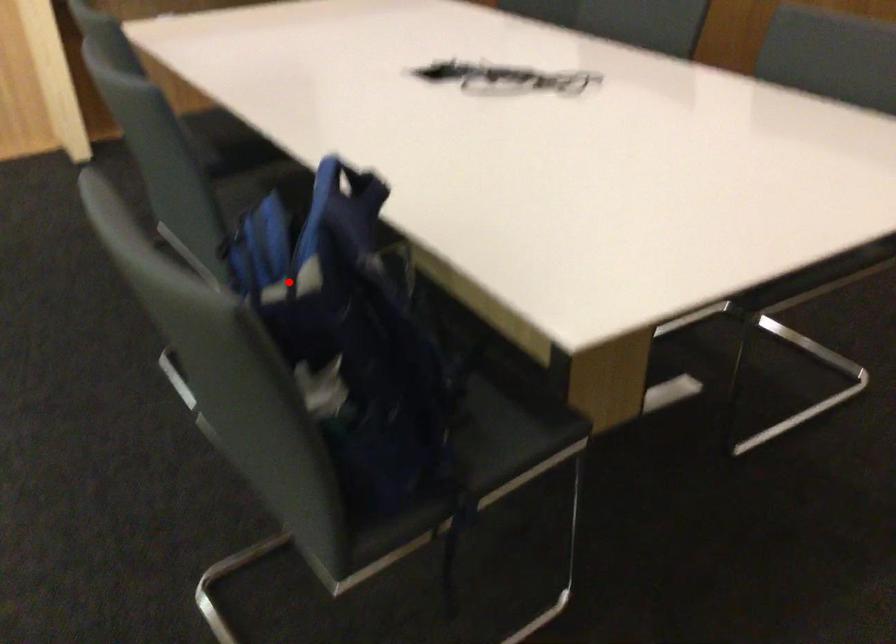
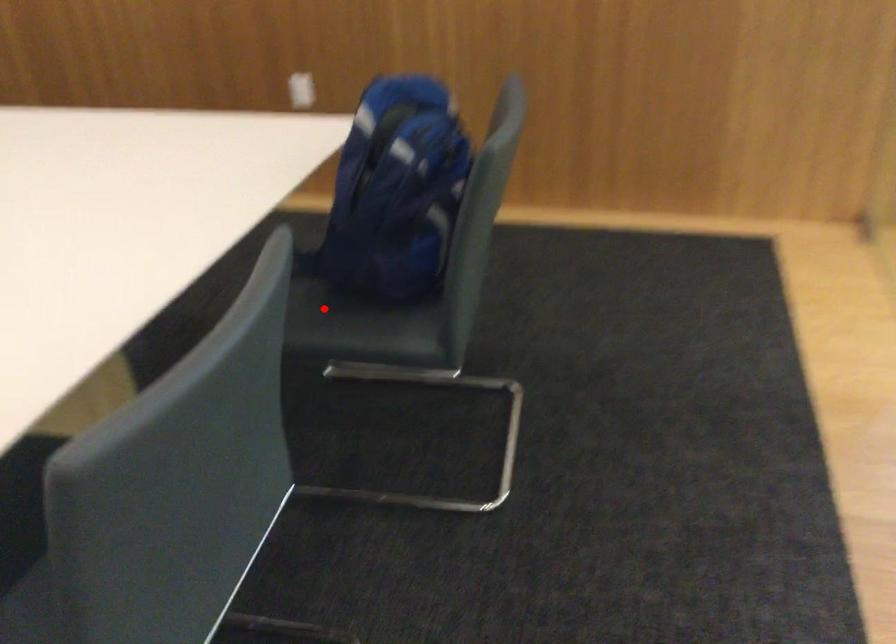
I am providing you with two images of the same scene from different viewpoints. A red point is marked on the first image and another point is marked on the second image. Is the marked point in image1 the same physical position as the marked point in image2?

Answer: No